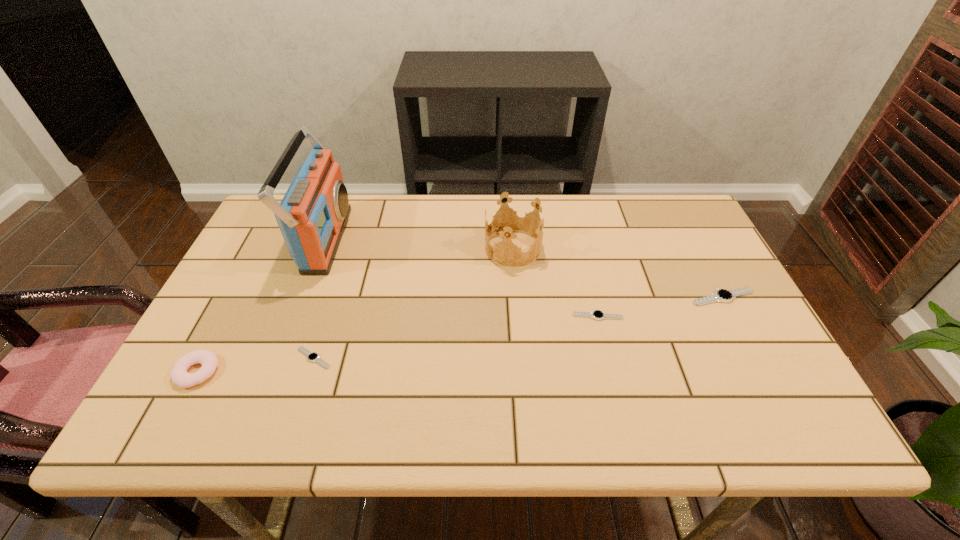
Locate an element on the screen. The height and width of the screenshot is (540, 960). free space between the nearest watch and the fifth shortest object is located at coordinates (413, 303).

The height and width of the screenshot is (540, 960). Identify the location of blank region between the tallest watch and the nearest watch. (518, 327).

Where is `object that is the second closest to the leftmost watch`? This screenshot has width=960, height=540. object that is the second closest to the leftmost watch is located at coordinates (312, 216).

Where is `object that ranks as the closest to the leftmost object`? object that ranks as the closest to the leftmost object is located at coordinates (314, 357).

Locate which watch is the second closest to the doughnut. Please provide its 2D coordinates. Your answer should be formatted as a tuple, i.e. [(x, y)], where the tuple contains the x and y coordinates of a point satisfying the conditions above.

[(597, 314)]

Locate which watch is the closest to the third tallest object. Please provide its 2D coordinates. Your answer should be formatted as a tuple, i.e. [(x, y)], where the tuple contains the x and y coordinates of a point satisfying the conditions above.

[(314, 357)]

The image size is (960, 540). I want to click on vacant area that satisfies the following two spatial constraints: 1. on the front-facing side of the radio receiver; 2. on the back side of the nearest watch, so click(280, 358).

I want to click on vacant area that satisfies the following two spatial constraints: 1. on the front-facing side of the tallest object; 2. on the left side of the third shortest object, so click(x=303, y=297).

Locate an element on the screen. The image size is (960, 540). vacant area that satisfies the following two spatial constraints: 1. on the front-facing side of the rightmost watch; 2. on the left side of the radio receiver is located at coordinates 303,297.